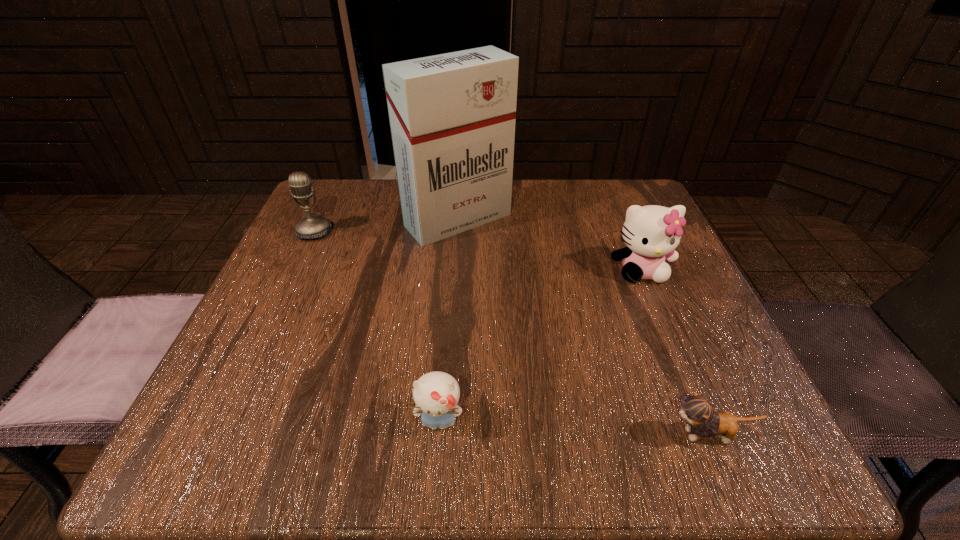
Where is `vacant space situated 0.360m on the front-facing side of the shortest object`? vacant space situated 0.360m on the front-facing side of the shortest object is located at coordinates pyautogui.click(x=414, y=435).

Image resolution: width=960 pixels, height=540 pixels. I want to click on free space located 0.350m on the front-facing side of the shortest object, so click(420, 435).

I want to click on vacant space situated on the front-facing side of the shortest object, so 469,435.

Where is `cigarette case located in the far edge section of the desktop`? The width and height of the screenshot is (960, 540). cigarette case located in the far edge section of the desktop is located at coordinates (452, 116).

At what (x,y) coordinates should I click in order to perform the action: click on microphone situated at the far edge. Please return your answer as a coordinate pair (x, y). The width and height of the screenshot is (960, 540). Looking at the image, I should click on (312, 226).

At what (x,y) coordinates should I click in order to perform the action: click on object positioned at the left edge. Please return your answer as a coordinate pair (x, y). The width and height of the screenshot is (960, 540). Looking at the image, I should click on (312, 226).

Image resolution: width=960 pixels, height=540 pixels. In order to click on object located at the far left corner in this screenshot , I will do click(x=312, y=226).

You are a GUI agent. You are given a task and a screenshot of the screen. Output one action in this format:
    pyautogui.click(x=<x>, y=<y>)
    Task: Click on the object present at the near right corner
    This screenshot has height=540, width=960.
    Given the screenshot: What is the action you would take?
    pyautogui.click(x=699, y=411)

Find the location of a particular element. vacant space at the far edge of the desktop is located at coordinates (512, 232).

Locate an element on the screen. The image size is (960, 540). free space at the near edge of the desktop is located at coordinates (467, 462).